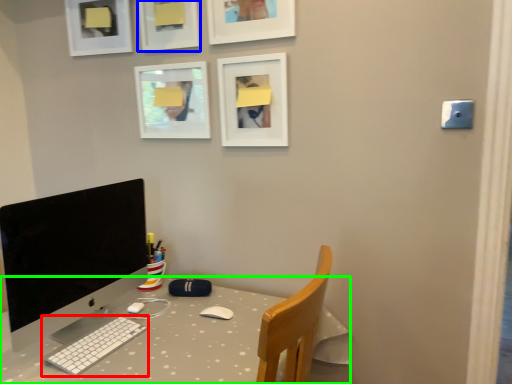
Question: Which object is the farthest from computer keyboard (highlighted by a red box)? Choose among these: picture frame (highlighted by a blue box) or desk (highlighted by a green box).

Choices:
 (A) picture frame
 (B) desk

Answer: (A)